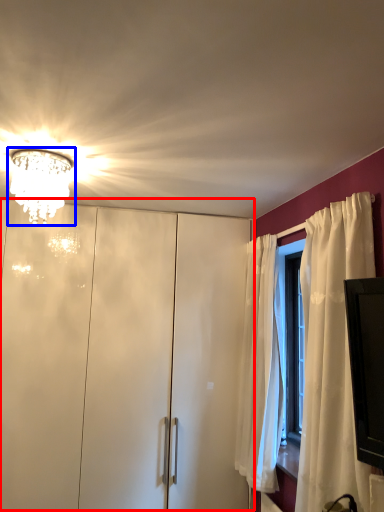
Question: Which point is further to the camera, dresser (highlighted by a red box) or lamp (highlighted by a blue box)?

Choices:
 (A) dresser
 (B) lamp

Answer: (A)